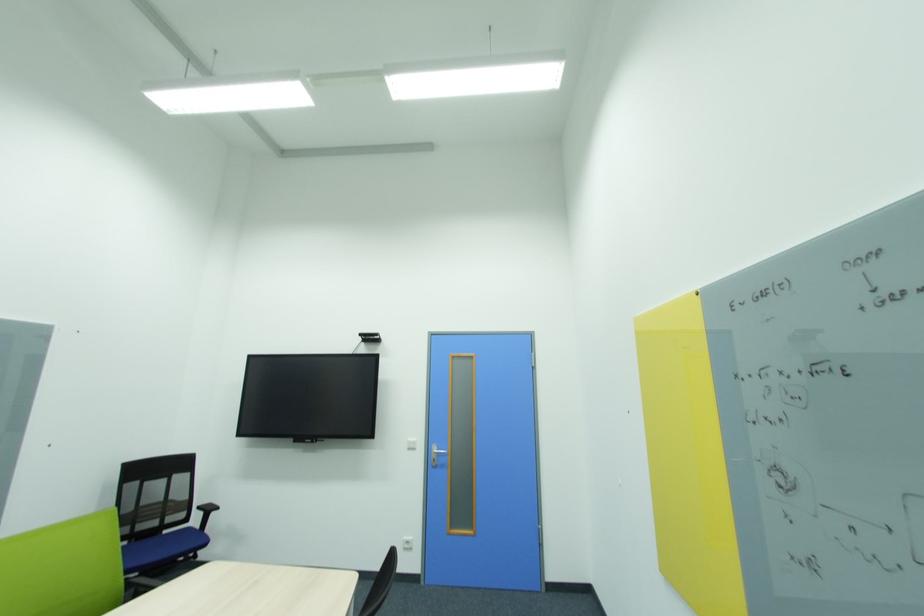
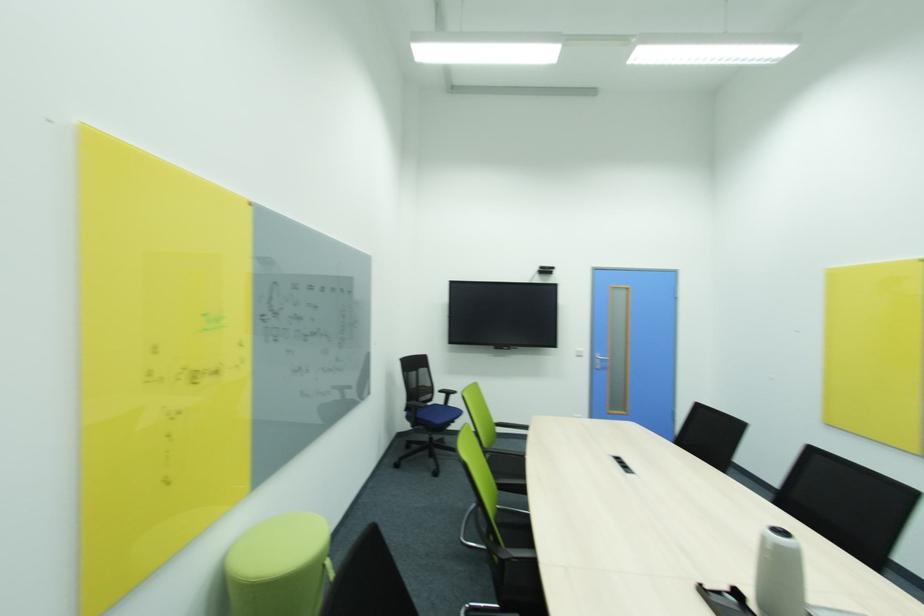
The images are taken continuously from a first-person perspective. In which direction are you moving?

The movement direction of the cameraman is left, backward.